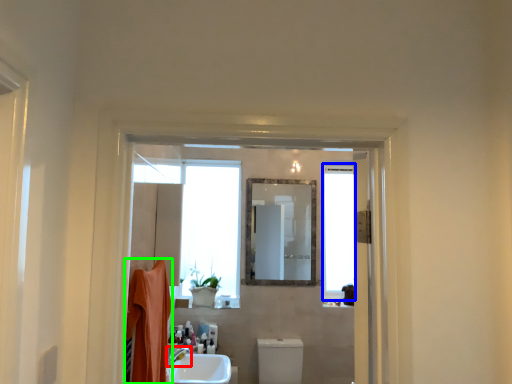
Question: Based on their relative distances, which object is farther from tap (highlighted by a red box)? Choose from window (highlighted by a blue box) and bath towel (highlighted by a green box).

Choices:
 (A) window
 (B) bath towel

Answer: (A)